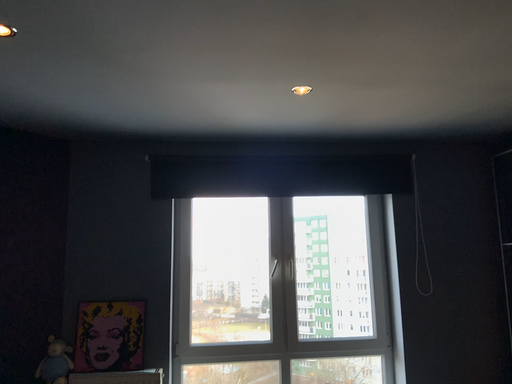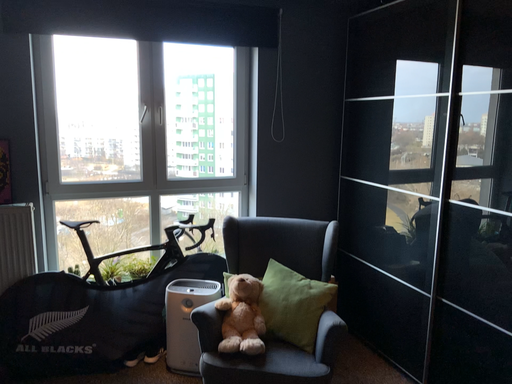
Question: How did the camera likely rotate when shooting the video?

Choices:
 (A) rotated upward
 (B) rotated downward

Answer: (B)